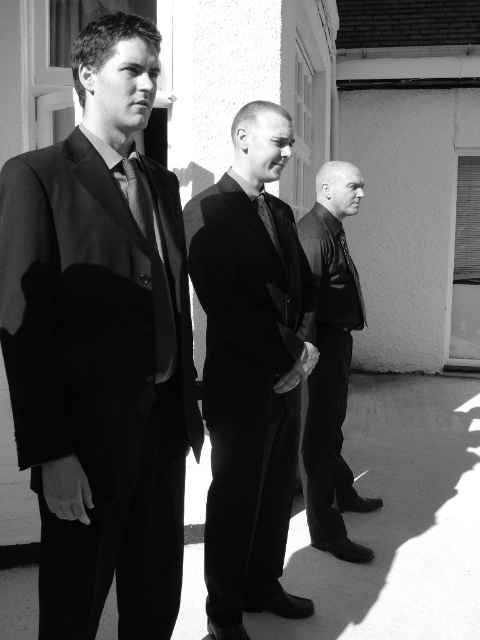
Question: Does smooth black jacket at center have a lesser width compared to textured black tie at center?

Choices:
 (A) yes
 (B) no

Answer: (B)

Question: Which point is farther from the camera taking this photo?

Choices:
 (A) (264, 220)
 (B) (241, 147)

Answer: (A)

Question: Which point is farther to the camera?

Choices:
 (A) matte black suit at center
 (B) textured black tie at center
 (C) matte black suit at left
 (D) smooth black jacket at center

Answer: (D)

Question: Which of these objects is positioned closest to the smooth black jacket at center?

Choices:
 (A) matte black suit at center
 (B) textured black tie at center
 (C) matte black tie at left

Answer: (A)

Question: Where is matte black tie at left located in relation to textured black tie at center in the image?

Choices:
 (A) left
 (B) right

Answer: (A)

Question: Is matte black suit at left positioned before textured black tie at center?

Choices:
 (A) yes
 (B) no

Answer: (A)